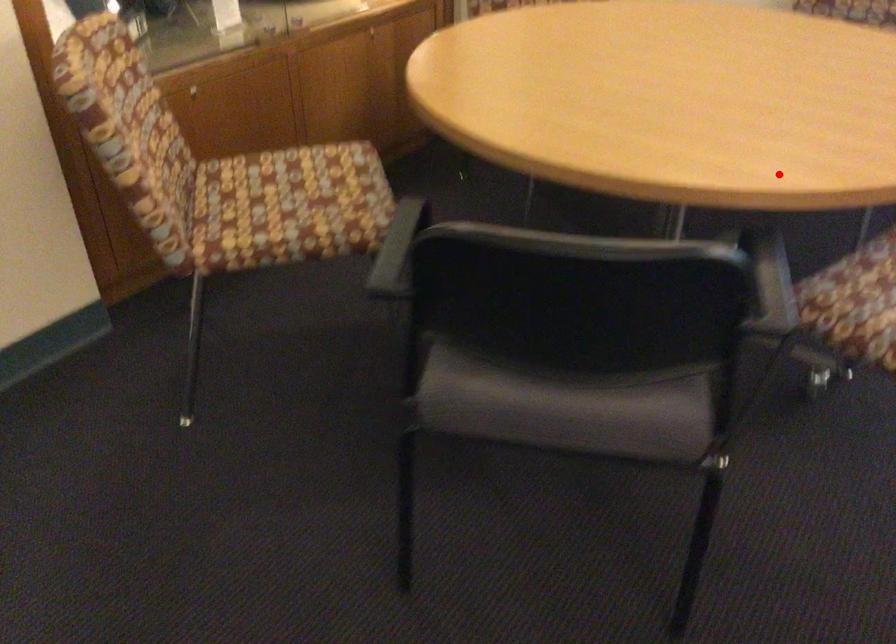
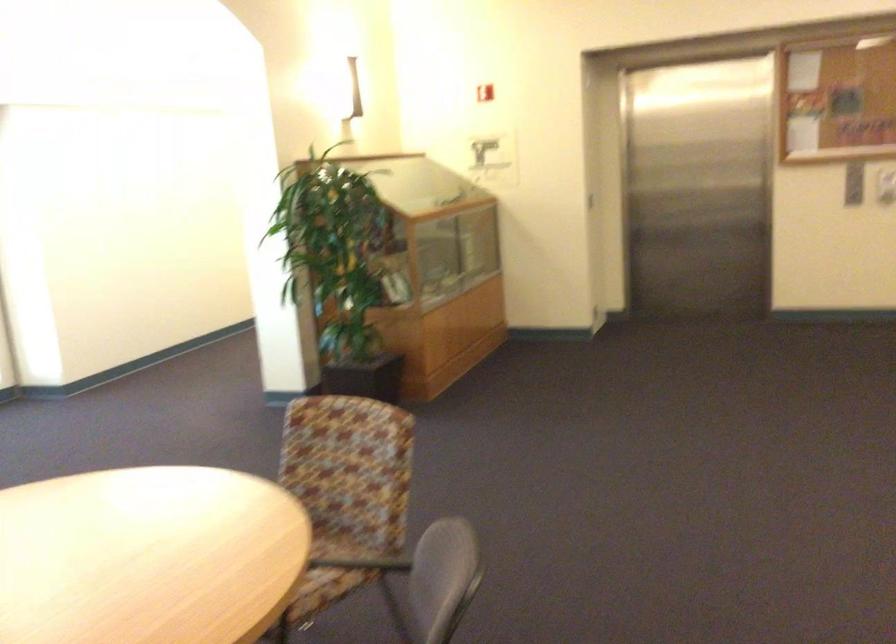
Question: I am providing you with two images of the same scene from different viewpoints. A red point is shown in image1. For the corresponding object point in image2, is it positioned nearer or farther from the camera?

Choices:
 (A) Nearer
 (B) Farther

Answer: (B)